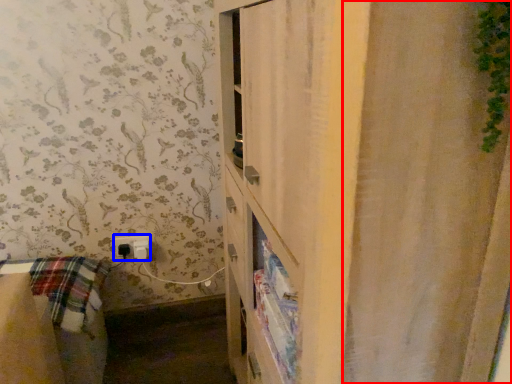
Question: Among these objects, which one is nearest to the camera, shower curtain (highlighted by a red box) or electric outlet (highlighted by a blue box)?

Choices:
 (A) shower curtain
 (B) electric outlet

Answer: (A)